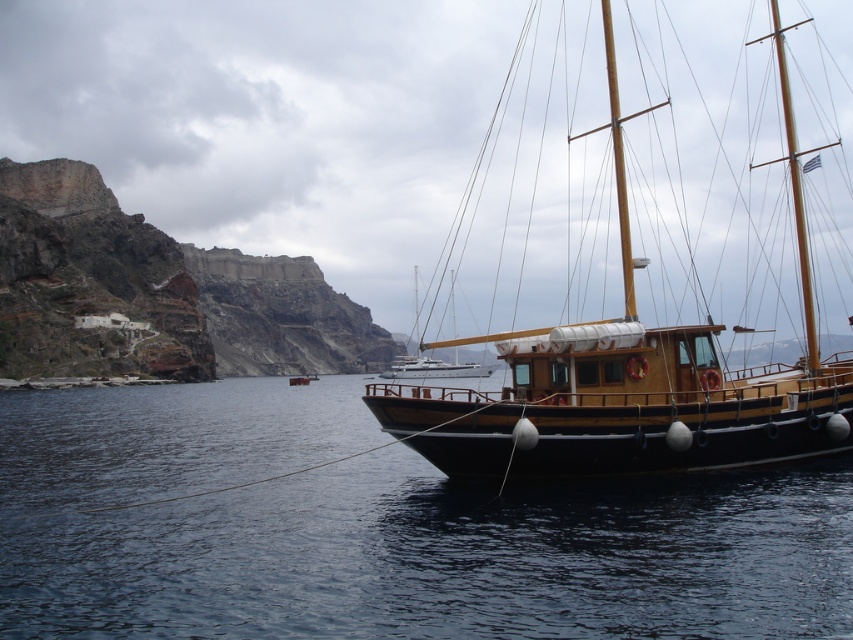
You are a sailor planning to anchor your boat near the wooden sailboat at right. You notice the dark blue water at lower left. Based on the scene, which area has a larger surface area for anchoring?

The wooden sailboat at right has a larger surface area than the dark blue water at lower left, so anchoring near the wooden sailboat at right would provide more space.